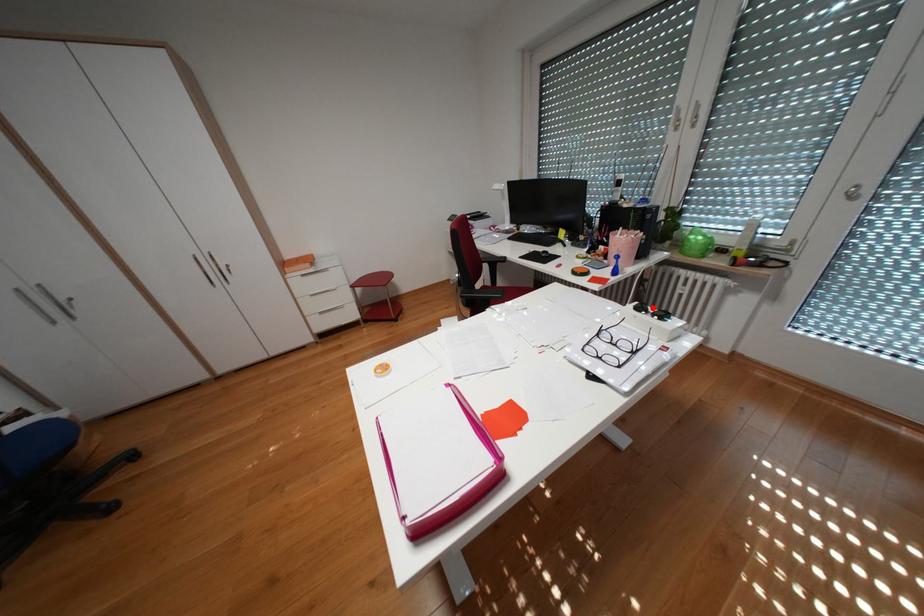
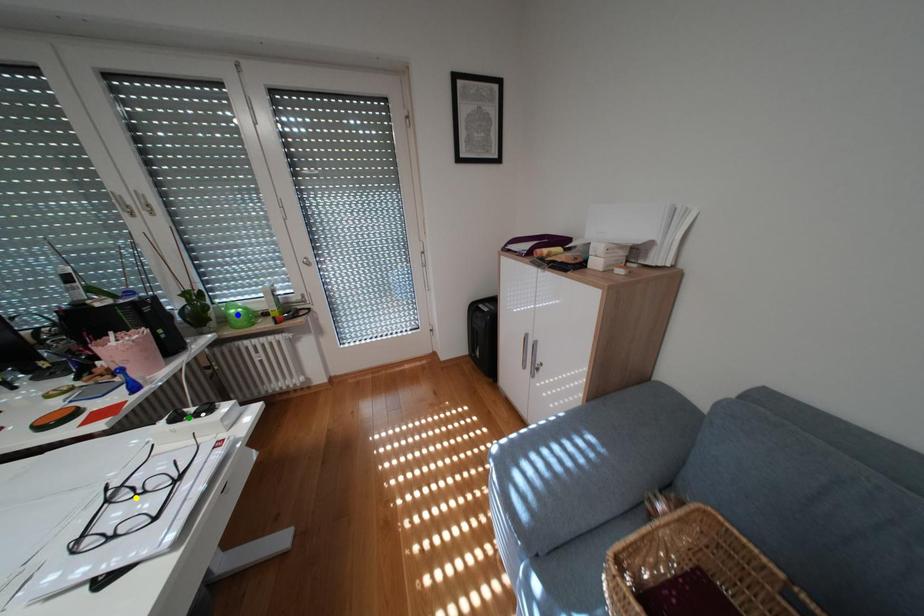
Question: I am providing you with two images of the same scene from different viewpoints. A red point is marked on the first image. You are given multiple points on the second image. Which spot in image 2 lines up with the point in image 1?

Choices:
 (A) blue point
 (B) yellow point
 (C) green point

Answer: (C)